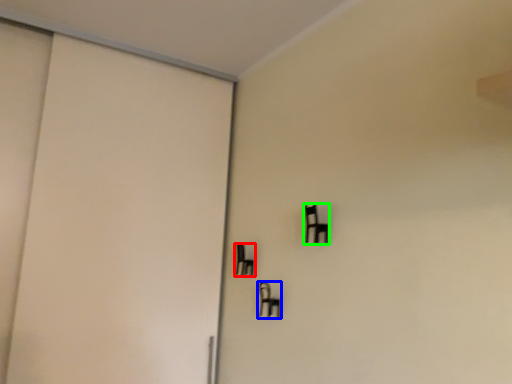
Question: Which object is the farthest from furniture (highlighted by a red box)? Choose among these: furniture (highlighted by a blue box) or furniture (highlighted by a green box).

Choices:
 (A) furniture
 (B) furniture

Answer: (B)